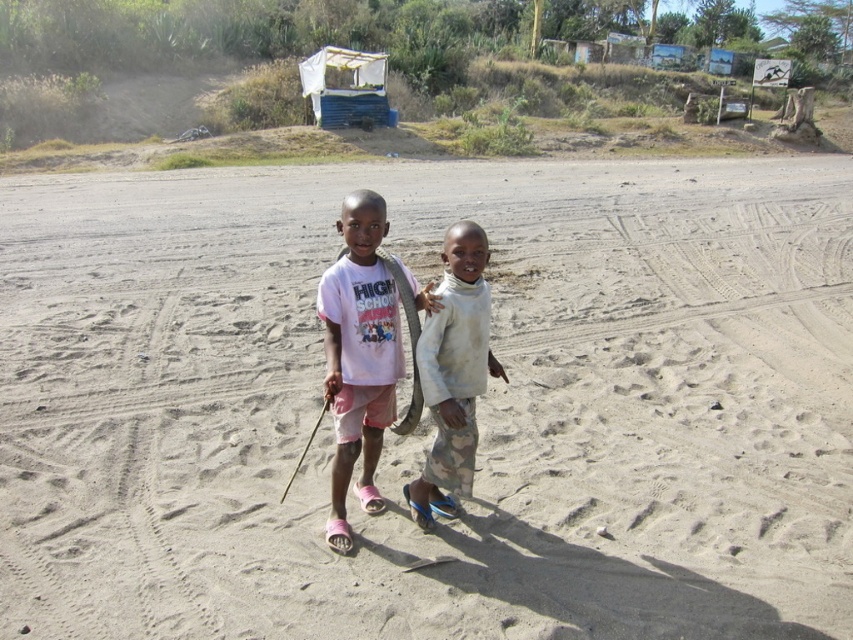
Question: Among these points, which one is farthest from the camera?

Choices:
 (A) (283, 492)
 (B) (415, 496)
 (C) (335, 538)

Answer: (A)

Question: Estimate the real-world distances between objects in this image. Which object is farther from the smooth wooden stick at center?

Choices:
 (A) white matte pants at center
 (B) white matte t-shirt at center

Answer: (A)

Question: Which point appears farthest from the camera in this image?

Choices:
 (A) (437, 451)
 (B) (369, 444)

Answer: (B)

Question: Does white matte t-shirt at center appear on the right side of smooth wooden stick at center?

Choices:
 (A) no
 (B) yes

Answer: (B)

Question: Is white matte t-shirt at center bigger than smooth wooden stick at center?

Choices:
 (A) yes
 (B) no

Answer: (A)

Question: Can you confirm if white matte pants at center is wider than smooth wooden stick at center?

Choices:
 (A) yes
 (B) no

Answer: (A)